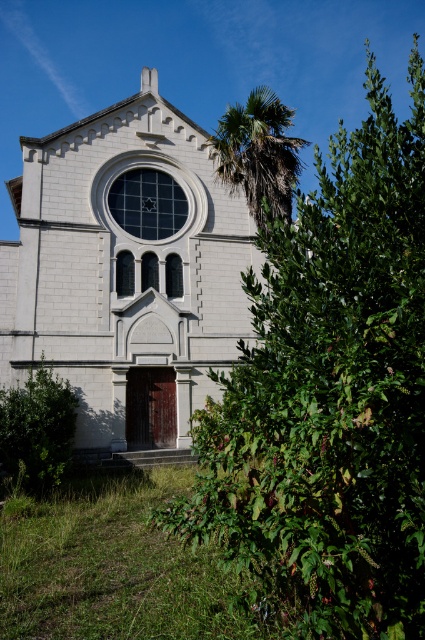
You are a gardener who needs to water the green leafy bush at center and the white stone church at center. Your watering can has a range of 5 meters. Can you water both plants without moving your position?

The distance between the green leafy bush at center and the white stone church at center is 4.95 meters, so yes, you can water both plants without moving your position since the distance is within the 5 meter range of your watering can.

You are standing in front of the building and want to place a small statue exactly at the center of the green leafy bush at center. What are the coordinates where you should place it?

The coordinates for the center of the green leafy bush at center are (329, 396).

You are standing in front of the building and notice two points marked on its facade. The first point is at coordinates point (x=365, y=182), and the second is at point (x=212, y=145). From your perspective, which point is closer to you?

Point (x=365, y=182) is in front of point (x=212, y=145), so it is closer to you.